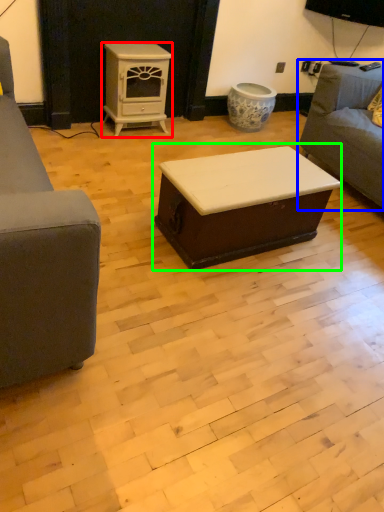
Question: Considering the real-world distances, which object is farthest from appliance (highlighted by a red box)? studio couch (highlighted by a blue box) or table (highlighted by a green box)?

Choices:
 (A) studio couch
 (B) table

Answer: (B)